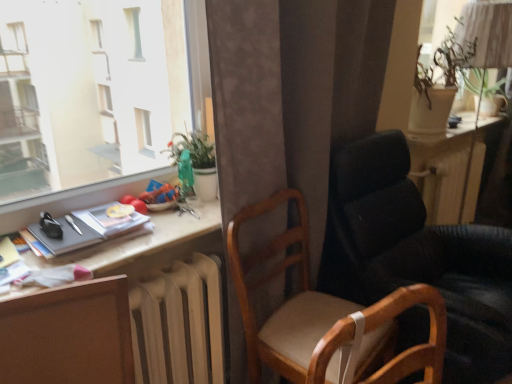
At what (x,y) coordinates should I click in order to perform the action: click on free space above white matte radiator at lower center (from a real-world perspective). Please return your answer as a coordinate pair (x, y). Looking at the image, I should click on (175, 269).